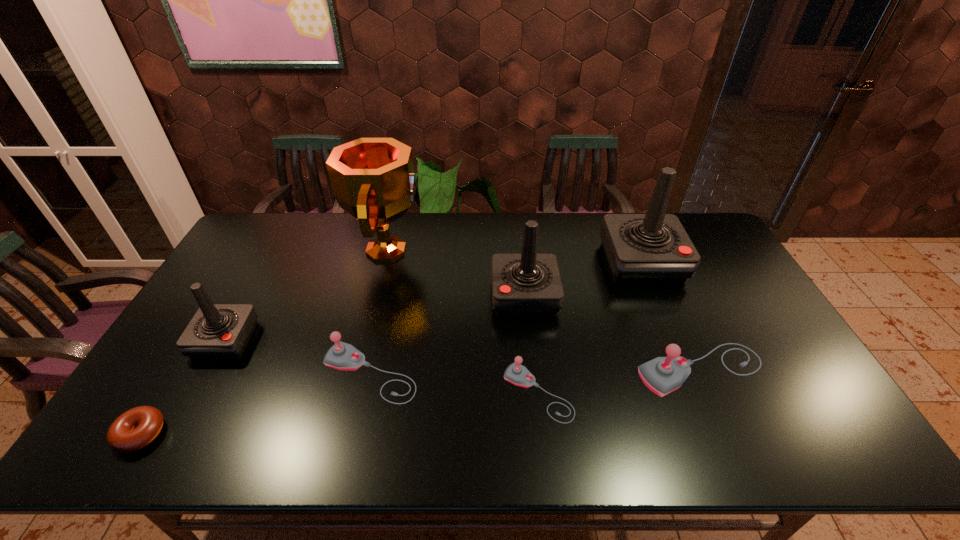
You are a GUI agent. You are given a task and a screenshot of the screen. Output one action in this format:
    pyautogui.click(x=<x>, y=<y>)
    Task: Click on the leftmost gray joystick
    The image size is (960, 540).
    Given the screenshot: What is the action you would take?
    pyautogui.click(x=342, y=356)

The image size is (960, 540). I want to click on the second gray joystick from left to right, so click(x=517, y=374).

The height and width of the screenshot is (540, 960). In order to click on the second shortest object in this screenshot , I will do `click(517, 374)`.

The height and width of the screenshot is (540, 960). In order to click on doughnut in this screenshot , I will do `click(134, 429)`.

The height and width of the screenshot is (540, 960). What are the coordinates of `chocolate doughnut` in the screenshot? It's located at (134, 429).

Locate an element on the screen. free region located 0.290m on the side of the gold award with the star emblem is located at coordinates (506, 250).

I want to click on free space located on the front-facing side of the biggest red joystick, so click(x=697, y=394).

The image size is (960, 540). Identify the location of vacant space located on the front-facing side of the third tallest object. click(x=370, y=296).

The image size is (960, 540). What are the coordinates of `vacant space located 0.370m on the front-facing side of the third tallest object` in the screenshot? It's located at (373, 296).

Where is `free location located on the front-facing side of the third tallest object`? free location located on the front-facing side of the third tallest object is located at coordinates (418, 296).